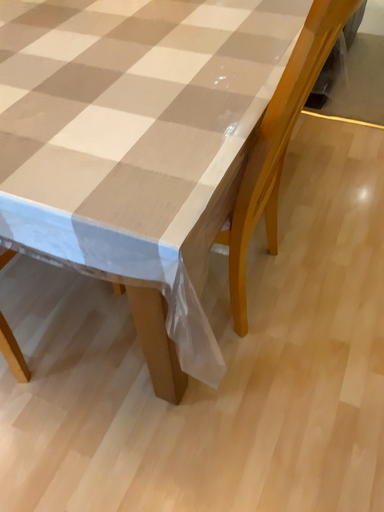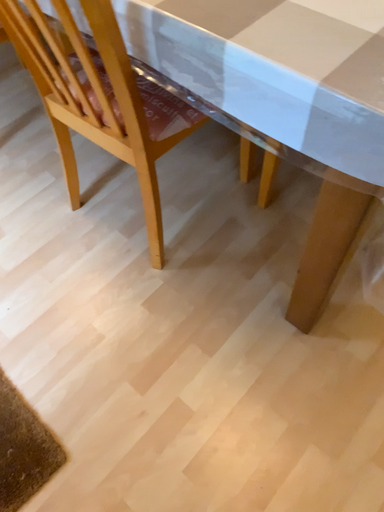
Question: How did the camera likely rotate when shooting the video?

Choices:
 (A) rotated downward
 (B) rotated upward

Answer: (A)